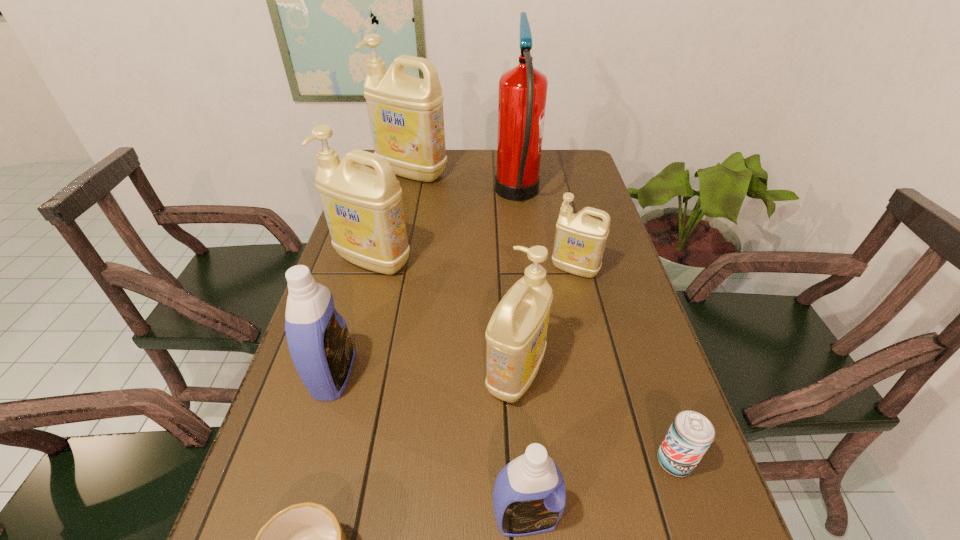
Locate which object is the fifth closest to the left blue detergent. Please provide its 2D coordinates. Your answer should be formatted as a tuple, i.e. [(x, y)], where the tuple contains the x and y coordinates of a point satisfying the conditions above.

[(580, 240)]

You are a GUI agent. You are given a task and a screenshot of the screen. Output one action in this format:
    pyautogui.click(x=<x>, y=<y>)
    Task: Click on the object that is the seventh closest to the third nearest object
    
    Given the screenshot: What is the action you would take?
    pyautogui.click(x=522, y=95)

Locate which detergent ranks third in proximity to the second beige detergent from right to left. Please provide its 2D coordinates. Your answer should be formatted as a tuple, i.e. [(x, y)], where the tuple contains the x and y coordinates of a point satisfying the conditions above.

[(317, 335)]

Locate which detergent ranks second in proximity to the red fire extinguisher. Please provide its 2D coordinates. Your answer should be formatted as a tuple, i.e. [(x, y)], where the tuple contains the x and y coordinates of a point satisfying the conditions above.

[(406, 116)]

Identify which beige detergent is the nearest to the seventh shortest object. Please provide its 2D coordinates. Your answer should be formatted as a tuple, i.e. [(x, y)], where the tuple contains the x and y coordinates of a point satisfying the conditions above.

[(516, 334)]

The width and height of the screenshot is (960, 540). What are the coordinates of `the third closest beige detergent relative to the eighth tallest object` in the screenshot? It's located at (363, 207).